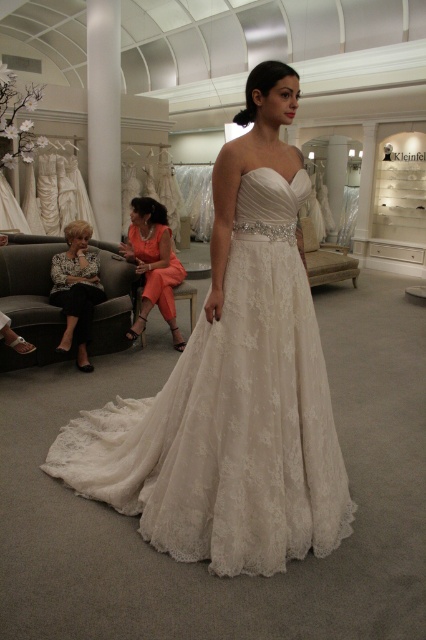
You are a customer in the bridal shop and want to try on both the orange satin dress at center and the black leather jacket at lower left. Which item should you pick up first if you want to minimize walking distance?

The orange satin dress at center is closer to you than the black leather jacket at lower left, so you should pick up the orange satin dress at center first to minimize walking distance.

You are a customer in the bridal shop and want to choose a dress that is bigger in size. Which dress should you pick between the ivory lace dress at center and the orange satin dress at center?

The ivory lace dress at center has a larger size compared to the orange satin dress at center, so you should pick the ivory lace dress at center.